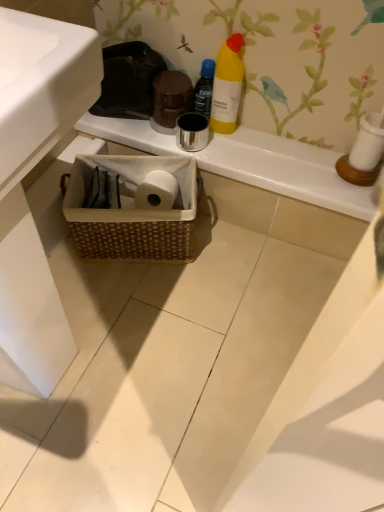
The height and width of the screenshot is (512, 384). In order to click on unoccupied region to the right of yellow matte bottle at upper center, which is the 1th bottle in right-to-left order in this screenshot , I will do `click(278, 141)`.